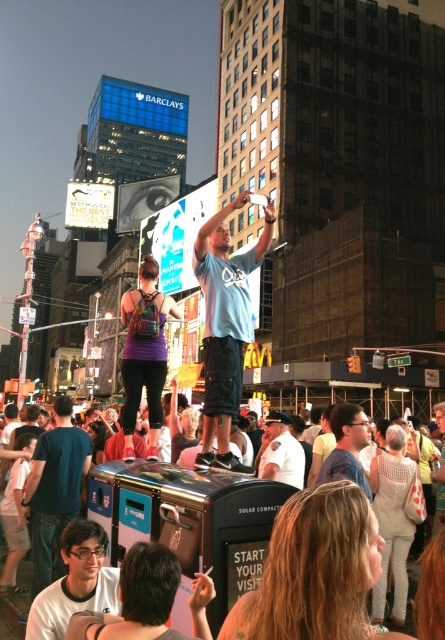
You are standing in Times Square, New York City, and want to take a photo of the crowd around the black trash bin with a solar panel. The trash bin is at point [214,300]. If you are 41.04 meters away from this point, is the trash bin visible in your photo?

The trash bin at point [214,300] is 41.04 meters away from you. Since the trash bin is part of the scene you are photographing, it should be visible in your photo as long as your camera can capture objects at that distance.

You are a photographer trying to capture both the matte blue shirt at center and the white shirt at center in a single frame. Which shirt should you focus on first to ensure both are in the frame?

The matte blue shirt at center is wider than the white shirt at center, so focus on the matte blue shirt at center first to ensure both are in the frame.